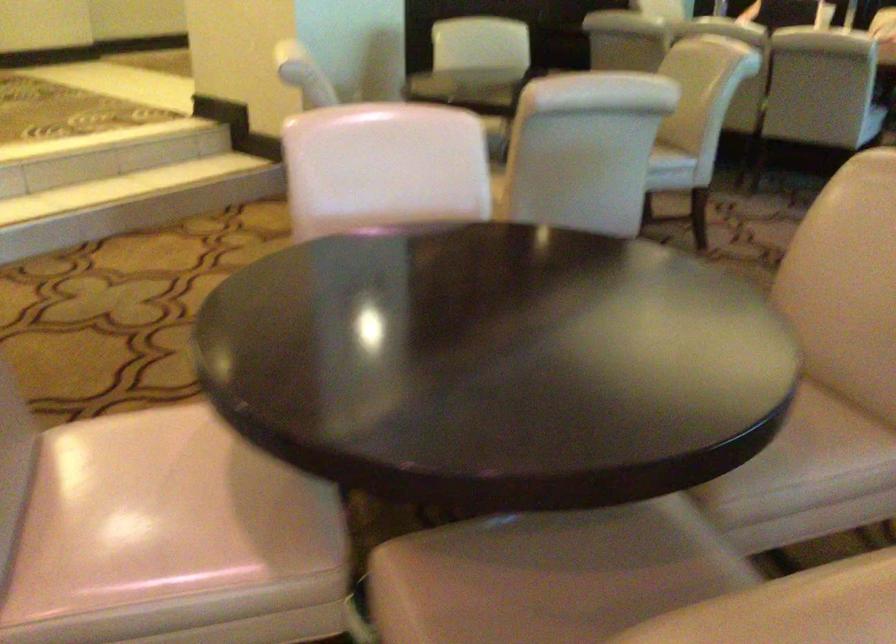
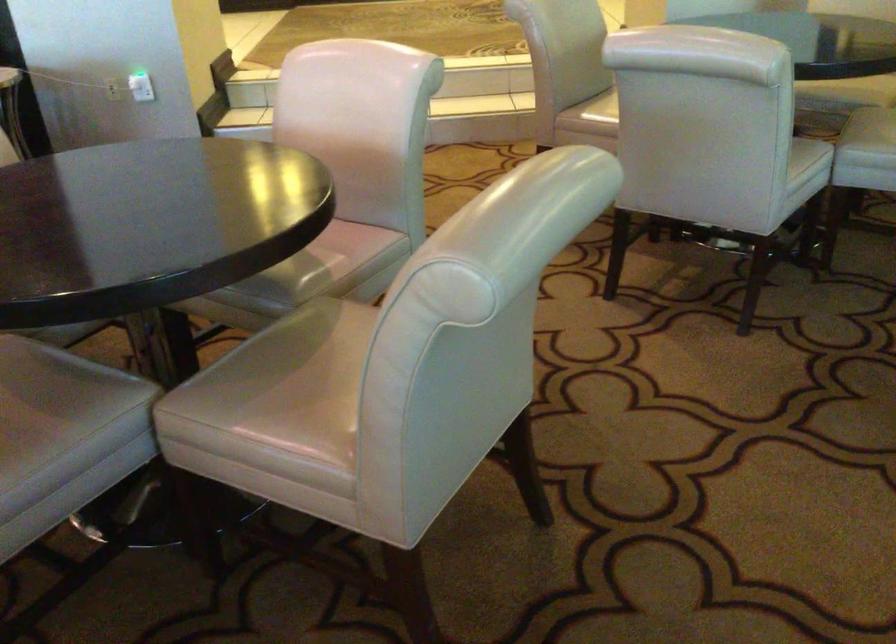
Locate, in the second image, the point that corresponds to [609,540] in the first image.

(56, 389)